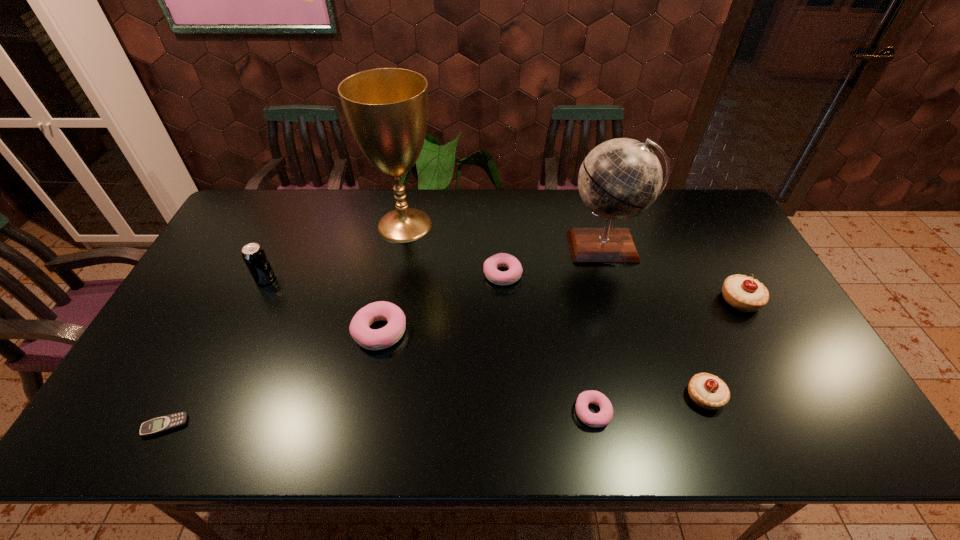
The image size is (960, 540). Identify the location of vacant region between the farthest pink pastry and the soda can. (384, 276).

Locate an element on the screen. This screenshot has height=540, width=960. free space that is in between the rightmost pink pastry and the leftmost pink pastry is located at coordinates (487, 372).

I want to click on free space between the eighth shortest object and the second shortest object, so click(599, 329).

Locate which object is the fourth closest to the shortest object. Please provide its 2D coordinates. Your answer should be formatted as a tuple, i.e. [(x, y)], where the tuple contains the x and y coordinates of a point satisfying the conditions above.

[(491, 264)]

Find the location of a particular element. This screenshot has height=540, width=960. object that is the fourth closest to the beeper is located at coordinates (491, 264).

Locate which pastry is the fourth closest to the tallest object. Please provide its 2D coordinates. Your answer should be formatted as a tuple, i.e. [(x, y)], where the tuple contains the x and y coordinates of a point satisfying the conditions above.

[(708, 391)]

Locate which pastry is the fourth closest to the second pastry from left to right. Please provide its 2D coordinates. Your answer should be formatted as a tuple, i.e. [(x, y)], where the tuple contains the x and y coordinates of a point satisfying the conditions above.

[(743, 293)]

Identify which pink pastry is the second nearest to the beeper. Please provide its 2D coordinates. Your answer should be formatted as a tuple, i.e. [(x, y)], where the tuple contains the x and y coordinates of a point satisfying the conditions above.

[(491, 264)]

I want to click on pink pastry that stands as the second closest to the third pastry from right to left, so click(x=359, y=328).

Identify the location of free location that satisfies the following two spatial constraints: 1. at the equator of the eighth shortest object; 2. on the left side of the fourth pastry from left to right. The image size is (960, 540). (649, 396).